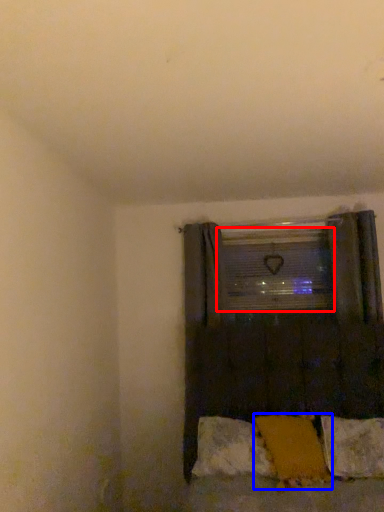
Question: Which object appears farthest to the camera in this image, window screen (highlighted by a red box) or pillow (highlighted by a blue box)?

Choices:
 (A) window screen
 (B) pillow

Answer: (A)